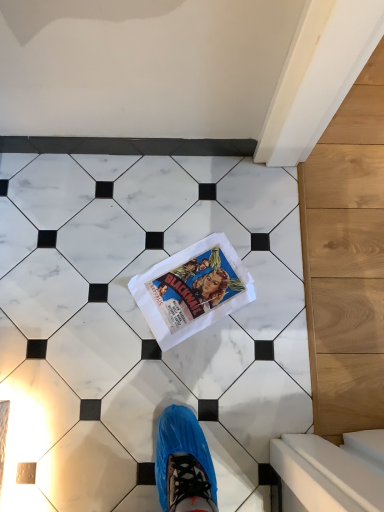
The image size is (384, 512). I want to click on vacant region to the left of white paper comic book at center, so click(x=110, y=281).